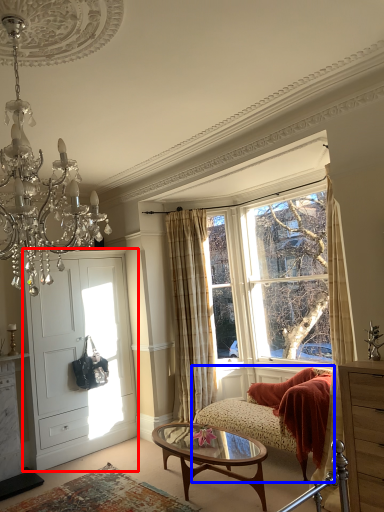
Question: Which point is closer to the camera, door (highlighted by a red box) or studio couch (highlighted by a blue box)?

Choices:
 (A) door
 (B) studio couch

Answer: (B)